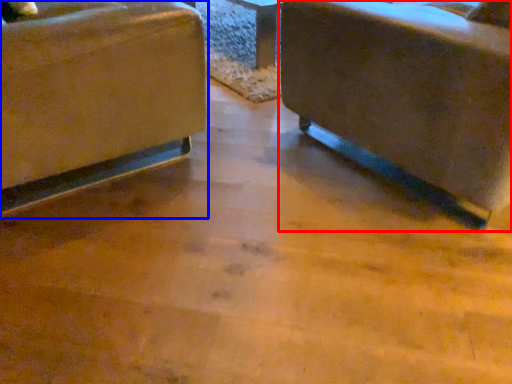
Question: Which object is closer to the camera taking this photo, chair (highlighted by a red box) or chair (highlighted by a blue box)?

Choices:
 (A) chair
 (B) chair

Answer: (A)